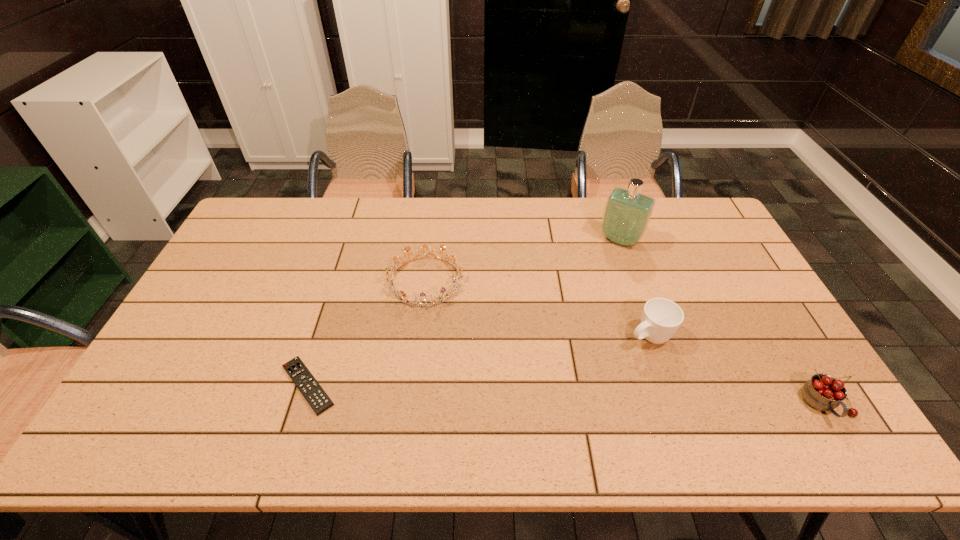
Where is `pot filled with cherries that is at the near edge`? Image resolution: width=960 pixels, height=540 pixels. pot filled with cherries that is at the near edge is located at coordinates (823, 392).

This screenshot has width=960, height=540. Identify the location of object present at the right edge. (823, 392).

You are a GUI agent. You are given a task and a screenshot of the screen. Output one action in this format:
    pyautogui.click(x=<x>, y=<y>)
    Task: Click on the object positioned at the near right corner
    The image size is (960, 540).
    Given the screenshot: What is the action you would take?
    pyautogui.click(x=823, y=392)

Image resolution: width=960 pixels, height=540 pixels. In the image, there is a desktop. Identify the location of free space at the far edge. (452, 208).

Image resolution: width=960 pixels, height=540 pixels. Identify the location of vacant space at the near edge. (409, 390).

The image size is (960, 540). What are the coordinates of `free space at the left edge of the desktop` in the screenshot? It's located at (265, 261).

Find the location of a particular element. The width and height of the screenshot is (960, 540). free space at the right edge is located at coordinates (717, 278).

Identify the location of vacant space at the far right corner of the desktop. The image size is (960, 540). (700, 217).

Locate an element on the screen. This screenshot has height=540, width=960. vacant space at the near right corner of the desktop is located at coordinates (797, 388).

Find the location of a particular element. empty space between the third nearest object and the pot filled with cherries is located at coordinates (737, 370).